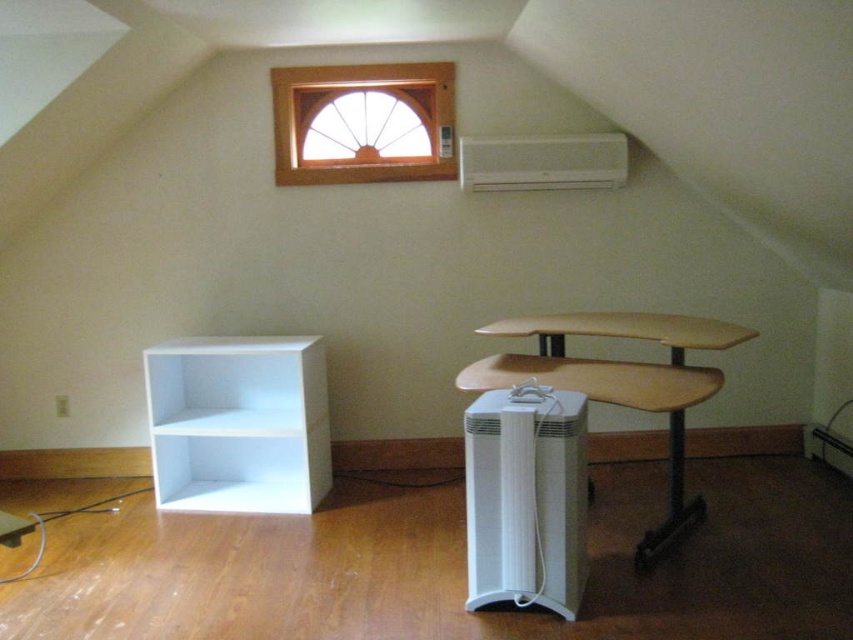
Question: Among these points, which one is nearest to the camera?

Choices:
 (A) (691, 518)
 (B) (335, 145)
 (C) (577, 154)
 (D) (273, 388)

Answer: (A)

Question: Which object is the closest to the white matte bookshelf at lower left?

Choices:
 (A) white plastic air conditioner at upper center
 (B) wooden window at upper center

Answer: (B)

Question: Is the position of white matte bookshelf at lower left more distant than that of wooden desk at center?

Choices:
 (A) yes
 (B) no

Answer: (A)

Question: Which object appears closest to the camera in this image?

Choices:
 (A) white plastic air conditioner at upper center
 (B) wooden desk at center
 (C) white matte bookshelf at lower left
 (D) wooden window at upper center

Answer: (B)

Question: Is white matte bookshelf at lower left smaller than wooden window at upper center?

Choices:
 (A) no
 (B) yes

Answer: (A)

Question: Does wooden window at upper center have a smaller size compared to white plastic air conditioner at upper center?

Choices:
 (A) yes
 (B) no

Answer: (B)